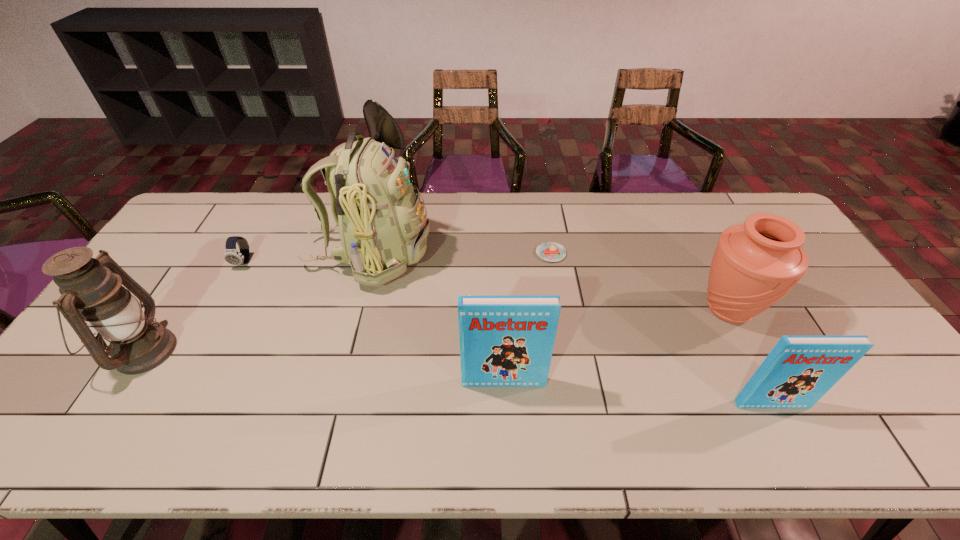
Where is `the left book`? Image resolution: width=960 pixels, height=540 pixels. the left book is located at coordinates (505, 341).

You are a GUI agent. You are given a task and a screenshot of the screen. Output one action in this format:
    pyautogui.click(x=<x>, y=<y>)
    Task: Click on the fourth object from right to left
    
    Given the screenshot: What is the action you would take?
    pyautogui.click(x=505, y=341)

This screenshot has width=960, height=540. Find the location of `the right book`. the right book is located at coordinates (799, 370).

I want to click on the nearest object, so click(x=799, y=370).

Locate an element on the screen. This screenshot has height=540, width=960. backpack is located at coordinates (381, 220).

Locate an element on the screen. the fifth object from right to left is located at coordinates (381, 220).

Find the location of `the fifth object from left to right`. the fifth object from left to right is located at coordinates 549,251.

What are the coordinates of `the shortest object` in the screenshot? It's located at (549, 251).

Locate an element on the screen. The width and height of the screenshot is (960, 540). vase is located at coordinates (x=755, y=264).

Locate an element on the screen. This screenshot has height=540, width=960. the second shortest object is located at coordinates (231, 255).